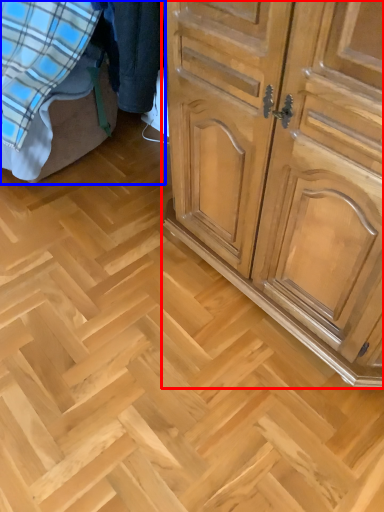
Question: Which object appears closest to the camera in this image, chest of drawers (highlighted by a red box) or bed (highlighted by a blue box)?

Choices:
 (A) chest of drawers
 (B) bed

Answer: (A)